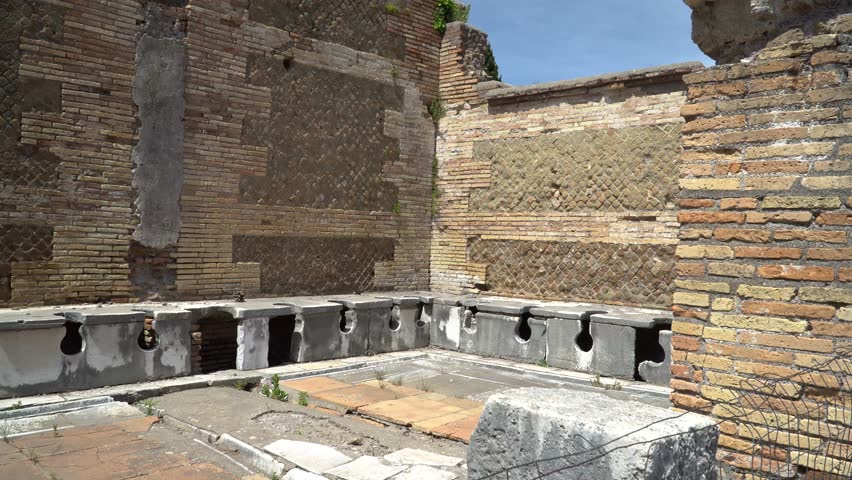
At what (x,y) coordinates should I click in order to perform the action: click on plant. Please return your answer as a coordinate pair (x, y). This screenshot has width=852, height=480. Looking at the image, I should click on (273, 389).